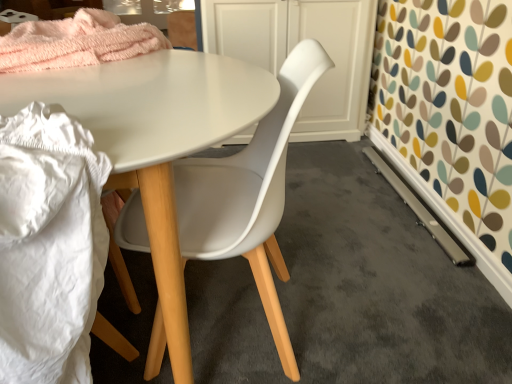
Question: From the image's perspective, relative to white plastic chair at center, is white matte cabinet at center above or below?

Choices:
 (A) above
 (B) below

Answer: (A)

Question: In the image, is white matte cabinet at center positioned in front of or behind white plastic chair at center?

Choices:
 (A) front
 (B) behind

Answer: (B)

Question: Which object is the closest to the white matte cabinet at center?

Choices:
 (A) white fabric at lower left
 (B) white plastic chair at center

Answer: (B)

Question: Which of these objects is positioned farthest from the white matte cabinet at center?

Choices:
 (A) white fabric at lower left
 (B) white plastic chair at center

Answer: (A)